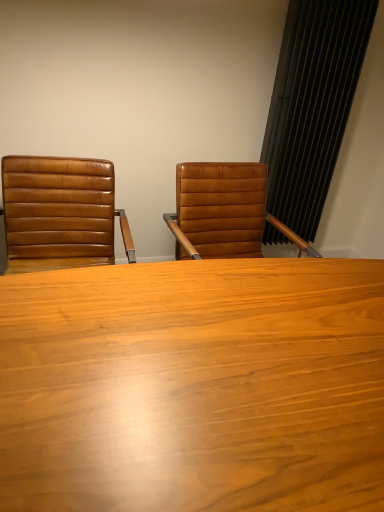
Question: Considering the relative sizes of black textured curtain at right and brown leather chair at left in the image provided, is black textured curtain at right thinner than brown leather chair at left?

Choices:
 (A) yes
 (B) no

Answer: (A)

Question: Does black textured curtain at right have a larger size compared to brown leather chair at left?

Choices:
 (A) no
 (B) yes

Answer: (A)

Question: Does black textured curtain at right appear on the left side of brown leather chair at left?

Choices:
 (A) no
 (B) yes

Answer: (A)

Question: Does black textured curtain at right have a greater width compared to brown leather chair at left?

Choices:
 (A) no
 (B) yes

Answer: (A)

Question: Could you tell me if black textured curtain at right is facing brown leather chair at left?

Choices:
 (A) yes
 (B) no

Answer: (B)

Question: Does black textured curtain at right have a smaller size compared to brown leather chair at left?

Choices:
 (A) yes
 (B) no

Answer: (A)

Question: Can you confirm if wooden table at center is thinner than brown leather chair at left?

Choices:
 (A) no
 (B) yes

Answer: (A)

Question: Can you see wooden table at center touching brown leather chair at left?

Choices:
 (A) yes
 (B) no

Answer: (B)

Question: Does wooden table at center have a lesser height compared to brown leather chair at left?

Choices:
 (A) yes
 (B) no

Answer: (B)

Question: Is brown leather chair at left located within wooden table at center?

Choices:
 (A) yes
 (B) no

Answer: (B)

Question: Can you confirm if wooden table at center is smaller than brown leather chair at left?

Choices:
 (A) yes
 (B) no

Answer: (B)

Question: Can you confirm if wooden table at center is wider than brown leather chair at left?

Choices:
 (A) yes
 (B) no

Answer: (A)

Question: Is brown leather chair at left thinner than black textured curtain at right?

Choices:
 (A) no
 (B) yes

Answer: (A)